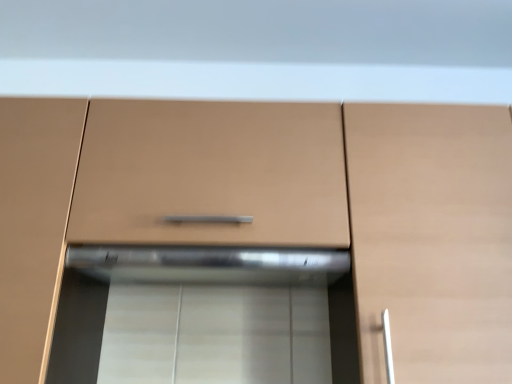
Question: From the image's perspective, is matte wood cabinet at right, the second cabinetry from the left, located above matte brown drawer at center?

Choices:
 (A) yes
 (B) no

Answer: (B)

Question: Considering the relative sizes of matte wood cabinet at right, the second cabinetry from the left, and matte brown drawer at center in the image provided, is matte wood cabinet at right, the second cabinetry from the left, thinner than matte brown drawer at center?

Choices:
 (A) yes
 (B) no

Answer: (B)

Question: Would you say matte wood cabinet at right, the second cabinetry from the left, is outside matte brown drawer at center?

Choices:
 (A) yes
 (B) no

Answer: (A)

Question: From a real-world perspective, is matte wood cabinet at right, the second cabinetry from the left, on matte brown drawer at center?

Choices:
 (A) yes
 (B) no

Answer: (B)

Question: Considering the relative sizes of matte wood cabinet at right, which is the first cabinetry in right-to-left order, and matte brown drawer at center in the image provided, is matte wood cabinet at right, which is the first cabinetry in right-to-left order, shorter than matte brown drawer at center?

Choices:
 (A) no
 (B) yes

Answer: (A)

Question: From the image's perspective, is matte wood cabinet at center, the 2th cabinetry viewed from the right, positioned above or below matte brown drawer at center?

Choices:
 (A) below
 (B) above

Answer: (A)

Question: In terms of height, does matte wood cabinet at center, the 2th cabinetry viewed from the right, look taller or shorter compared to matte brown drawer at center?

Choices:
 (A) short
 (B) tall

Answer: (B)

Question: Does point pos(10,297) appear closer or farther from the camera than point pos(231,183)?

Choices:
 (A) closer
 (B) farther

Answer: (A)

Question: Is matte wood cabinet at center, which is the first cabinetry in left-to-right order, to the left or to the right of matte brown drawer at center in the image?

Choices:
 (A) left
 (B) right

Answer: (A)

Question: From the image's perspective, relative to matte wood cabinet at center, the 2th cabinetry viewed from the right, is matte wood cabinet at right, which is the first cabinetry in right-to-left order, above or below?

Choices:
 (A) above
 (B) below

Answer: (B)

Question: Considering the positions of matte wood cabinet at right, the second cabinetry from the left, and matte wood cabinet at center, which is the first cabinetry in left-to-right order, in the image, is matte wood cabinet at right, the second cabinetry from the left, bigger or smaller than matte wood cabinet at center, which is the first cabinetry in left-to-right order,?

Choices:
 (A) small
 (B) big

Answer: (B)

Question: From a real-world perspective, relative to matte wood cabinet at center, the 2th cabinetry viewed from the right, is matte wood cabinet at right, the second cabinetry from the left, vertically above or below?

Choices:
 (A) below
 (B) above

Answer: (B)

Question: Is matte wood cabinet at right, which is the first cabinetry in right-to-left order, taller or shorter than matte wood cabinet at center, the 2th cabinetry viewed from the right?

Choices:
 (A) short
 (B) tall

Answer: (A)

Question: In the image, is matte brown drawer at center positioned in front of or behind matte wood cabinet at center, the 2th cabinetry viewed from the right?

Choices:
 (A) behind
 (B) front

Answer: (A)

Question: From their relative heights in the image, would you say matte brown drawer at center is taller or shorter than matte wood cabinet at center, which is the first cabinetry in left-to-right order?

Choices:
 (A) tall
 (B) short

Answer: (B)